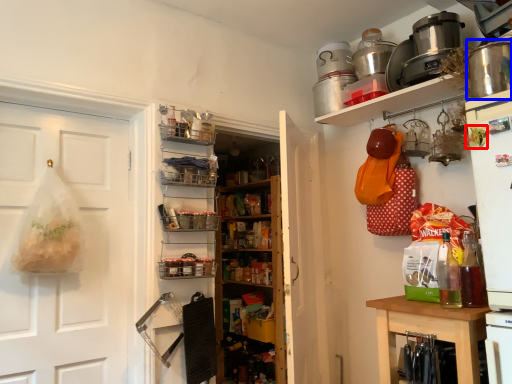
Question: Which point is closer to the camera, food (highlighted by a red box) or appliance (highlighted by a blue box)?

Choices:
 (A) food
 (B) appliance

Answer: (B)